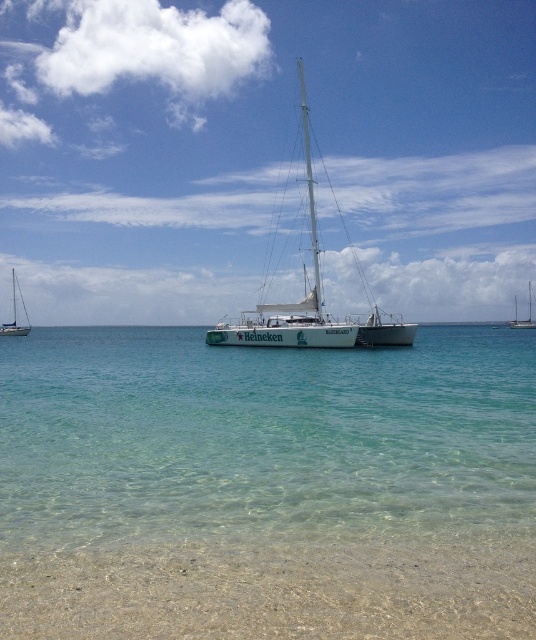
Question: Does white glossy sailboat at center have a lesser width compared to white glossy sailboat at right?

Choices:
 (A) no
 (B) yes

Answer: (B)

Question: Which object is the farthest from the white glossy sailboat at left?

Choices:
 (A) white glossy mast at center
 (B) white glossy sailboat at right

Answer: (B)

Question: Does clear sand at lower center appear on the right side of white glossy sailboat at center?

Choices:
 (A) yes
 (B) no

Answer: (B)

Question: Among these objects, which one is nearest to the camera?

Choices:
 (A) white glossy sailboat at right
 (B) white glossy sailboat at center
 (C) white glossy sailboat at left

Answer: (B)

Question: Which point is closer to the camera?

Choices:
 (A) clear sand at lower center
 (B) white glossy sailboat at left

Answer: (A)

Question: Is clear sand at lower center smaller than white glossy sailboat at center?

Choices:
 (A) yes
 (B) no

Answer: (A)